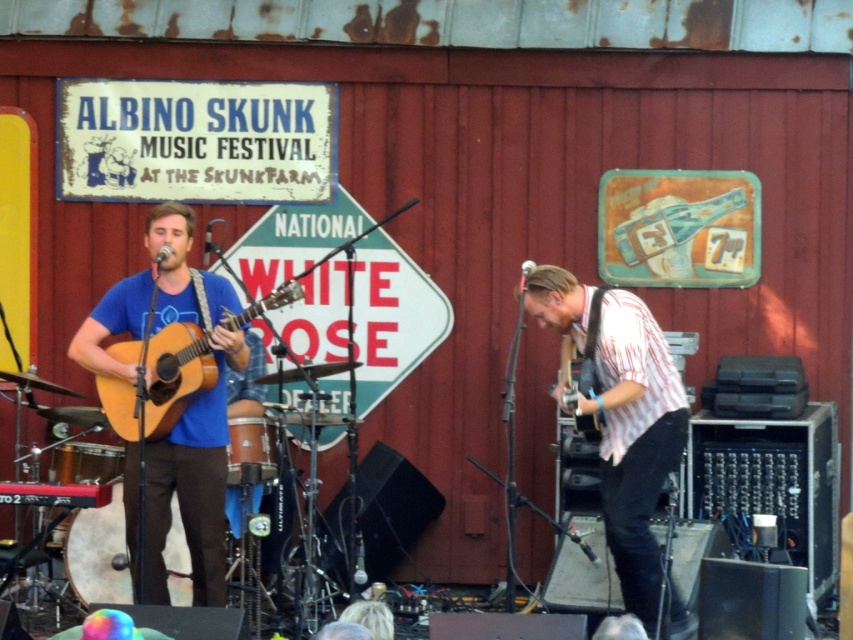
You are a photographer at the music festival and need to frame a shot that includes both the matte blue shirt at left and the matte black electric guitar at right. Given their sizes, which object will require more space in the frame to capture its full width?

The matte blue shirt at left requires more space in the frame because its width is larger than the matte black electric guitar at right.

What is the color of the shirt worn by the person located at point (x=619, y=416)?

The white striped shirt at center is represented by point (x=619, y=416), so the color is white striped.

You are standing at the point with coordinates point (157, 403) and want to move to the point with coordinates point (602, 288). Is the point you want to reach in front of or behind you?

The point (602, 288) is behind point (157, 403), so the point you want to reach is behind you.